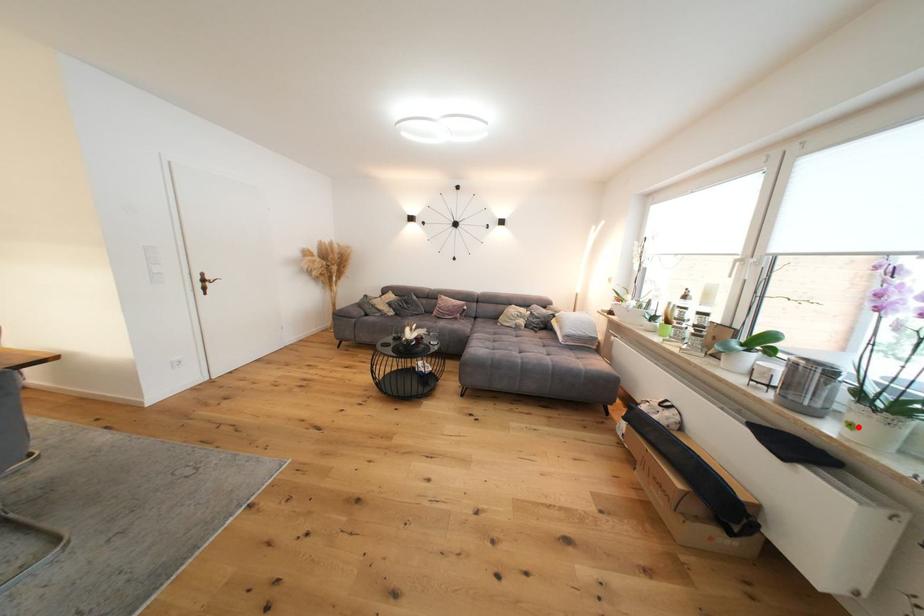
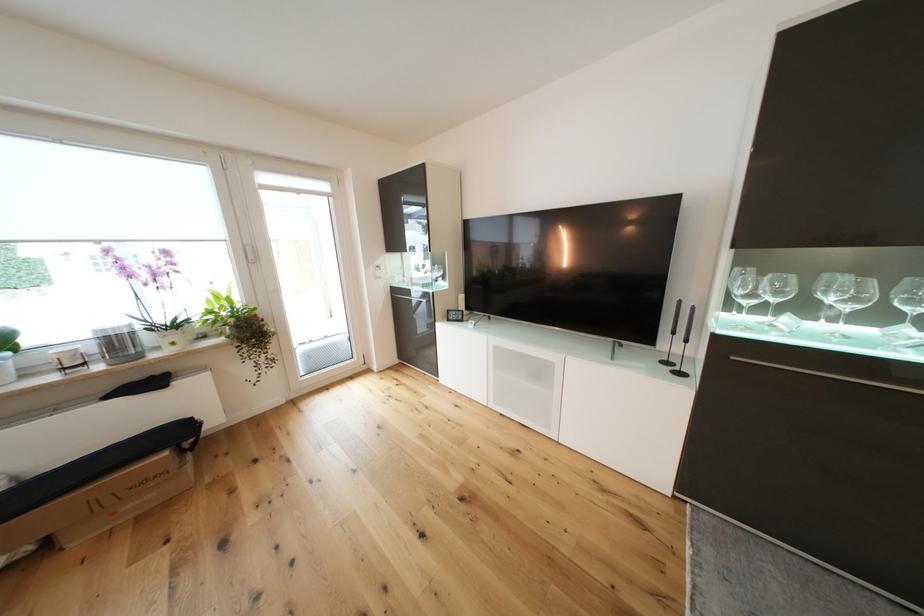
Question: I am providing you with two images of the same scene from different viewpoints. Image1 has a red point marked. In image2, the corresponding 3D location appears at what relative position? Reply with the corresponding letter.

Choices:
 (A) Closer
 (B) Farther

Answer: (A)